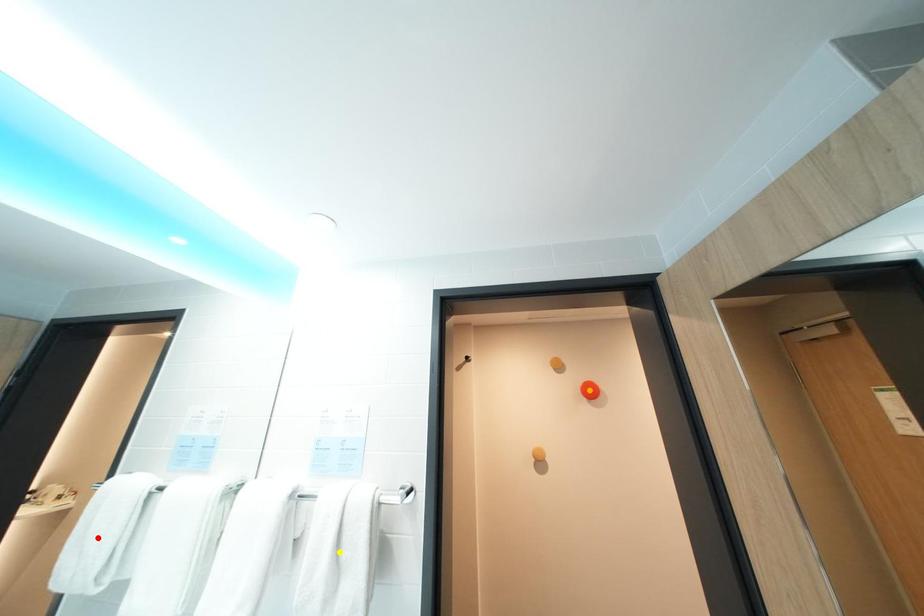
Order these from nearest to farthest:
A) orange point
B) yellow point
C) red point

orange point → red point → yellow point